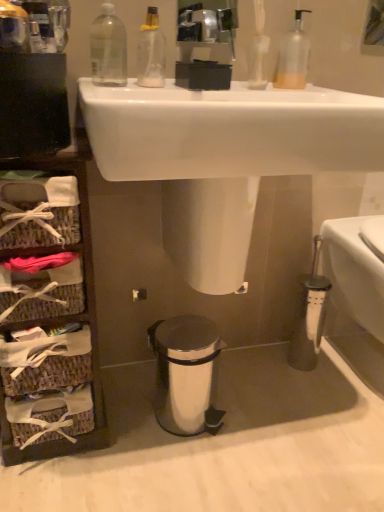
Question: Can you confirm if silver metallic trash can at lower center is positioned to the right of clear plastic bottle at upper left?

Choices:
 (A) yes
 (B) no

Answer: (A)

Question: Is silver metallic trash can at lower center outside of clear plastic bottle at upper left?

Choices:
 (A) yes
 (B) no

Answer: (A)

Question: Is silver metallic trash can at lower center thinner than clear plastic bottle at upper left?

Choices:
 (A) no
 (B) yes

Answer: (A)

Question: Does silver metallic trash can at lower center have a lesser height compared to clear plastic bottle at upper left?

Choices:
 (A) yes
 (B) no

Answer: (B)

Question: Is silver metallic trash can at lower center looking in the opposite direction of clear plastic bottle at upper left?

Choices:
 (A) no
 (B) yes

Answer: (A)

Question: From the image's perspective, is silver metallic trash can at lower center over clear plastic bottle at upper left?

Choices:
 (A) no
 (B) yes

Answer: (A)

Question: From the image's perspective, would you say translucent plastic soap dispenser at upper center, acting as the first cleaning product starting from the right, is positioned over silver metallic trash can at lower center?

Choices:
 (A) yes
 (B) no

Answer: (A)

Question: Considering the relative sizes of translucent plastic soap dispenser at upper center, which ranks as the second cleaning product in left-to-right order, and silver metallic trash can at lower center in the image provided, is translucent plastic soap dispenser at upper center, which ranks as the second cleaning product in left-to-right order, bigger than silver metallic trash can at lower center?

Choices:
 (A) yes
 (B) no

Answer: (B)

Question: Considering the relative sizes of translucent plastic soap dispenser at upper center, acting as the first cleaning product starting from the right, and silver metallic trash can at lower center in the image provided, is translucent plastic soap dispenser at upper center, acting as the first cleaning product starting from the right, taller than silver metallic trash can at lower center?

Choices:
 (A) no
 (B) yes

Answer: (A)

Question: Are translucent plastic soap dispenser at upper center, acting as the first cleaning product starting from the right, and silver metallic trash can at lower center far apart?

Choices:
 (A) yes
 (B) no

Answer: (B)

Question: Is translucent plastic soap dispenser at upper center, which ranks as the second cleaning product in left-to-right order, oriented towards silver metallic trash can at lower center?

Choices:
 (A) no
 (B) yes

Answer: (A)

Question: Considering the relative sizes of translucent plastic soap dispenser at upper center, which ranks as the second cleaning product in left-to-right order, and silver metallic trash can at lower center in the image provided, is translucent plastic soap dispenser at upper center, which ranks as the second cleaning product in left-to-right order, smaller than silver metallic trash can at lower center?

Choices:
 (A) yes
 (B) no

Answer: (A)

Question: From a real-world perspective, does white glossy toilet bowl at right stand above transparent plastic bottle at upper center, arranged as the 2th cleaning product when viewed from the right?

Choices:
 (A) yes
 (B) no

Answer: (B)